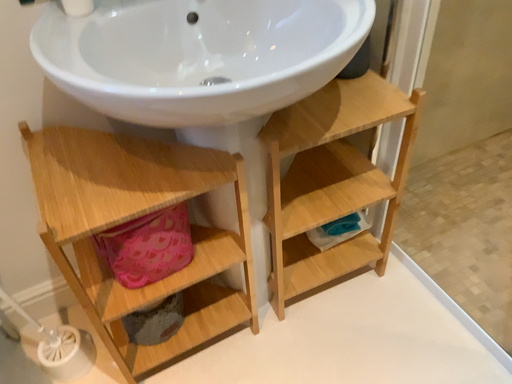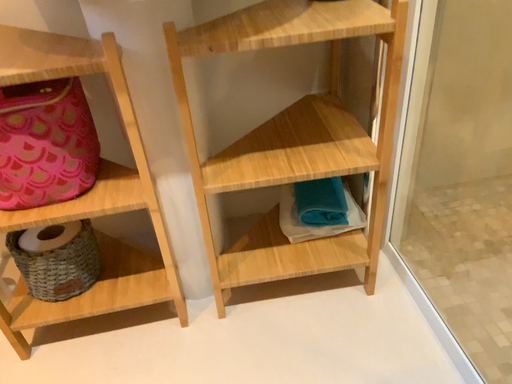
Question: Which way did the camera rotate in the video?

Choices:
 (A) rotated downward
 (B) rotated upward

Answer: (B)